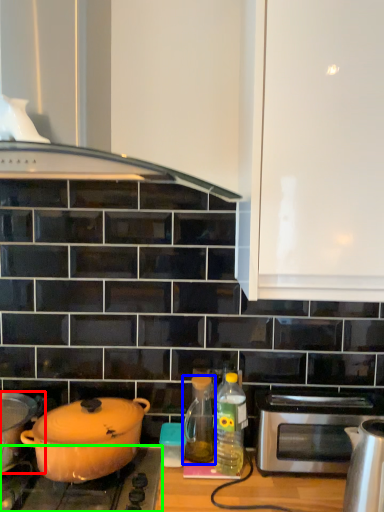
Question: Based on their relative distances, which object is nearer to kitchen appliance (highlighted by a red box)? Choose from bottle (highlighted by a blue box) and gas stove (highlighted by a green box).

Choices:
 (A) bottle
 (B) gas stove

Answer: (B)